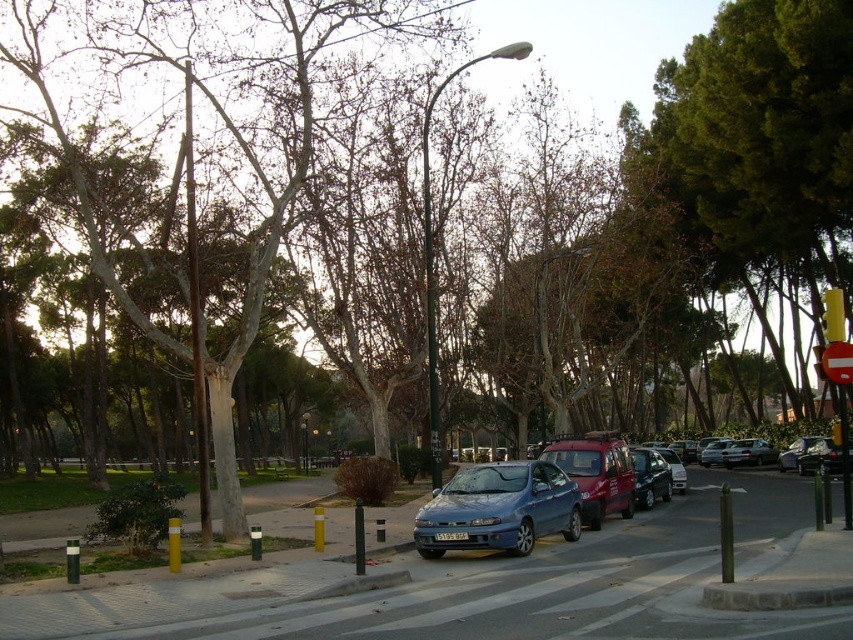
Question: Is satin blue sedan at center to the left of satin silver sedan at center-right from the viewer's perspective?

Choices:
 (A) no
 (B) yes

Answer: (B)

Question: Can you confirm if metallic blue sedan at center is thinner than satin silver sedan at center-right?

Choices:
 (A) yes
 (B) no

Answer: (B)

Question: Which of the following is the farthest from the observer?

Choices:
 (A) click(770, 451)
 (B) click(479, 524)

Answer: (A)

Question: Which point is farther to the camera?

Choices:
 (A) green leafy tree at upper right
 (B) metallic blue sedan at center
 (C) satin blue sedan at center
 (D) satin silver sedan at center-right

Answer: (D)

Question: Which point is closer to the camera?

Choices:
 (A) (749, 464)
 (B) (549, 508)
 (C) (706, 113)
 (D) (514, 524)

Answer: (D)

Question: Observing the image, what is the correct spatial positioning of green leafy tree at upper right in reference to satin blue sedan at center?

Choices:
 (A) below
 (B) above

Answer: (B)